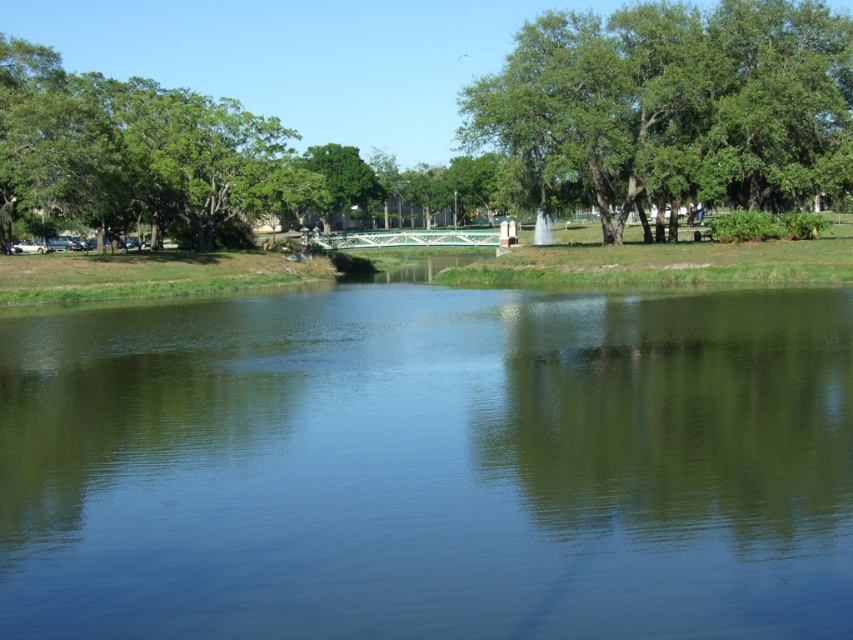
You are standing at the edge of the water in the park and see two points marked on the bridge. The first point is at coordinates point (466, 129) and the second is at point (200, 211). Which point is closer to you?

Point (466, 129) is closer to the viewer than point (200, 211).

You are a landscape architect designing a walking path that must pass between the green reflective water at center and the green leafy tree at upper left. The path needs to be 35 meters long. Will the path fit between them?

The distance between the green reflective water at center and the green leafy tree at upper left is 36.25 meters, so the 35 meter path will fit between them with 1.25 meters of space remaining.